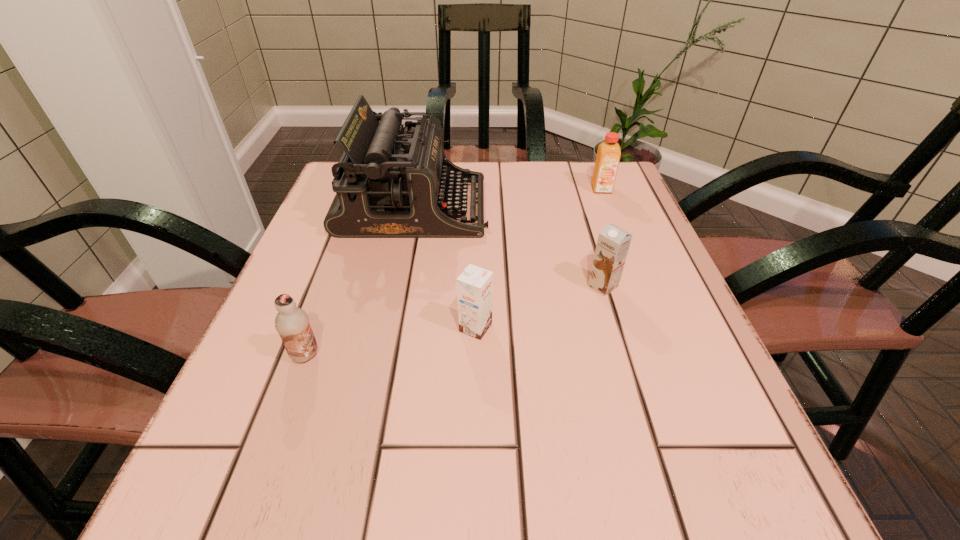
You are a GUI agent. You are given a task and a screenshot of the screen. Output one action in this format:
    pyautogui.click(x=<x>, y=<y>)
    Task: Click on the typewriter
    Image resolution: width=960 pixels, height=540 pixels.
    Given the screenshot: What is the action you would take?
    pyautogui.click(x=390, y=183)

This screenshot has width=960, height=540. Identify the location of orange juice. click(608, 155).

Image resolution: width=960 pixels, height=540 pixels. I want to click on the fourth object from left to right, so click(613, 243).

You are a GUI agent. You are given a task and a screenshot of the screen. Output one action in this format:
    pyautogui.click(x=<x>, y=<y>)
    Task: Click on the third nearest object
    This screenshot has height=540, width=960.
    Given the screenshot: What is the action you would take?
    pyautogui.click(x=613, y=243)

Find the location of a particular element. The height and width of the screenshot is (540, 960). the nearest chocolate milk is located at coordinates (292, 323).

Identify the location of the nearest object. The image size is (960, 540). (292, 323).

Identify the location of the second chocolate milk from left to right. The height and width of the screenshot is (540, 960). (475, 285).

I want to click on the second nearest object, so click(475, 285).

This screenshot has height=540, width=960. What are the coordinates of `blank area located 0.240m on the keyboard of the tallest object` in the screenshot? It's located at (592, 207).

Locate an element on the screen. free space located 0.120m on the front and back of the rightmost object is located at coordinates (615, 224).